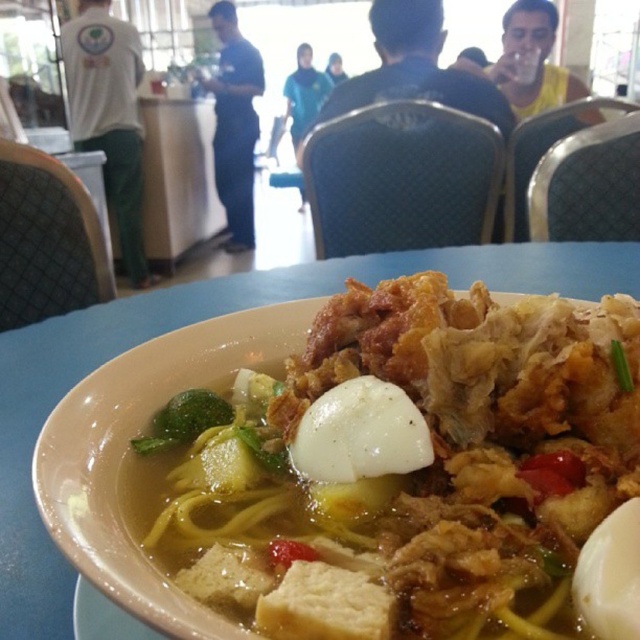
Question: Is translucent white egg at center in front of white smooth egg at center?

Choices:
 (A) no
 (B) yes

Answer: (B)

Question: Which of the following is the farthest from the observer?

Choices:
 (A) (628, 618)
 (B) (186, 419)
 (C) (166, 502)

Answer: (B)

Question: Where is white matte egg at center located in relation to green leafy vegetable at center in the image?

Choices:
 (A) left
 (B) right

Answer: (B)

Question: Is translucent white egg at center above white matte egg at center?

Choices:
 (A) yes
 (B) no

Answer: (A)

Question: Which is nearer to the translucent white egg at center?

Choices:
 (A) white matte egg at center
 (B) white smooth egg at center

Answer: (B)

Question: Which point is closer to the camera?

Choices:
 (A) (349, 454)
 (B) (355, 540)
 (C) (156, 432)
 (D) (577, 586)

Answer: (D)